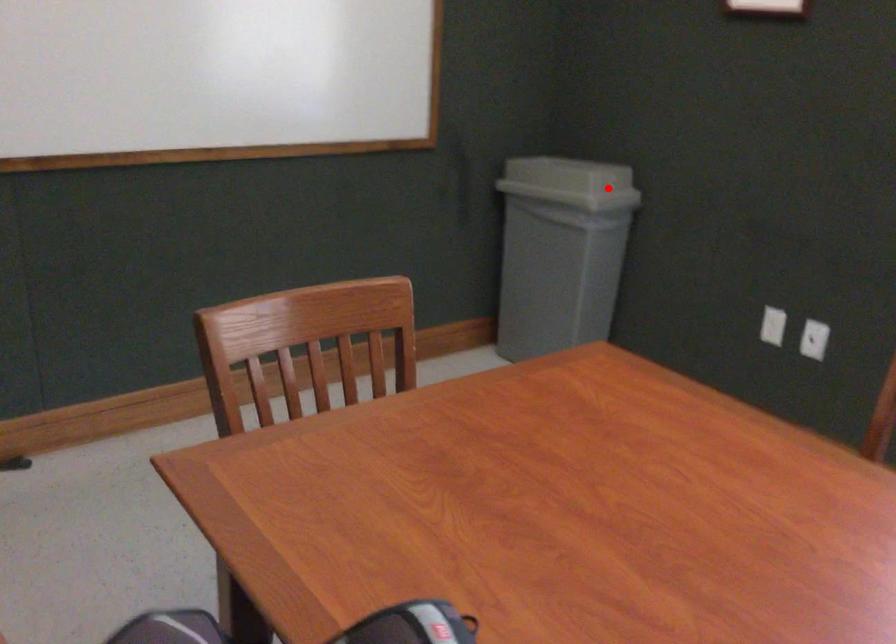
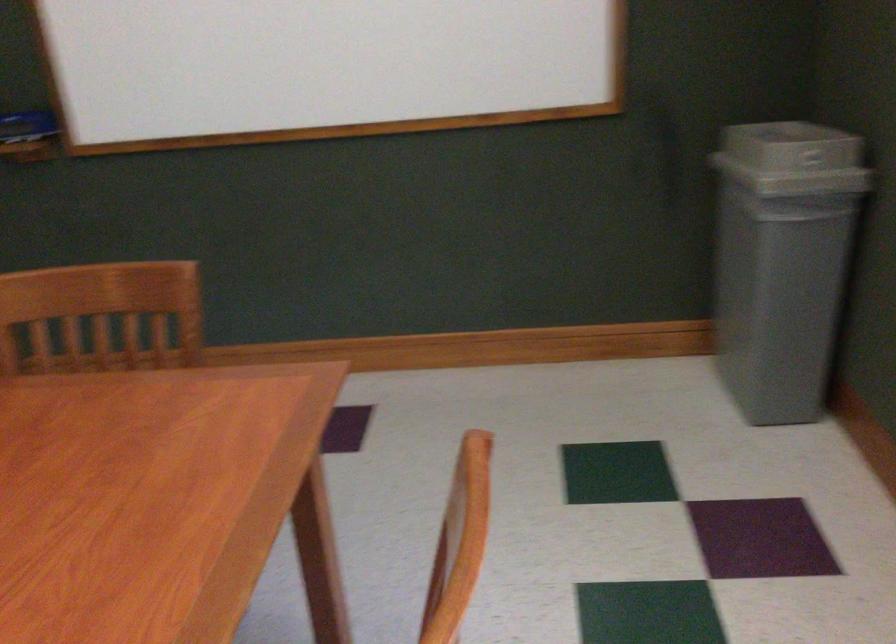
In the second image, find the point that corresponds to the highlighted location in the first image.

(793, 167)